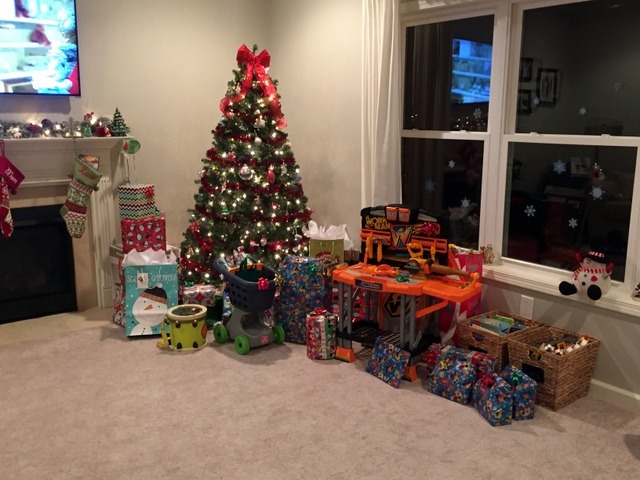
Where is `christmas stockings`? This screenshot has width=640, height=480. christmas stockings is located at coordinates (4, 199), (84, 189).